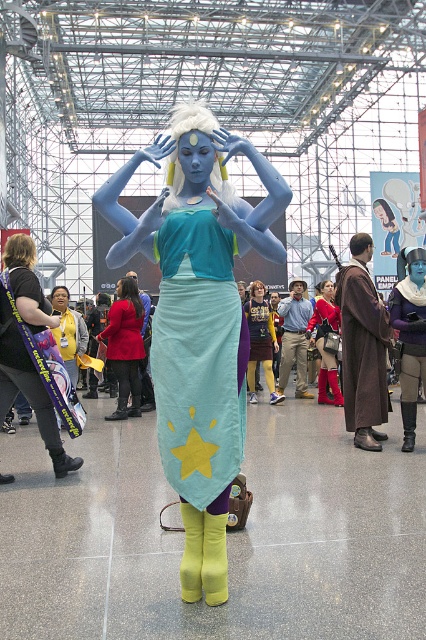
Question: Based on their relative distances, which object is farther from the teal fabric skirt at center?

Choices:
 (A) brown woolen robe at right
 (B) matte blue skin at center
 (C) matte blue skirt at center

Answer: (C)

Question: Is brown woolen robe at right below matte blue skirt at center?

Choices:
 (A) no
 (B) yes

Answer: (A)

Question: Which object appears closest to the camera in this image?

Choices:
 (A) brown woolen robe at right
 (B) matte black jacket at center

Answer: (A)

Question: Observing the image, what is the correct spatial positioning of matte blue mermaid at center in reference to matte blue skin at center?

Choices:
 (A) below
 (B) above

Answer: (B)

Question: Can you confirm if matte red coat at center is positioned to the right of matte black jacket at center?

Choices:
 (A) yes
 (B) no

Answer: (A)

Question: Which point is closer to the camera?

Choices:
 (A) brown woolen robe at right
 (B) shiny red boots at center

Answer: (A)